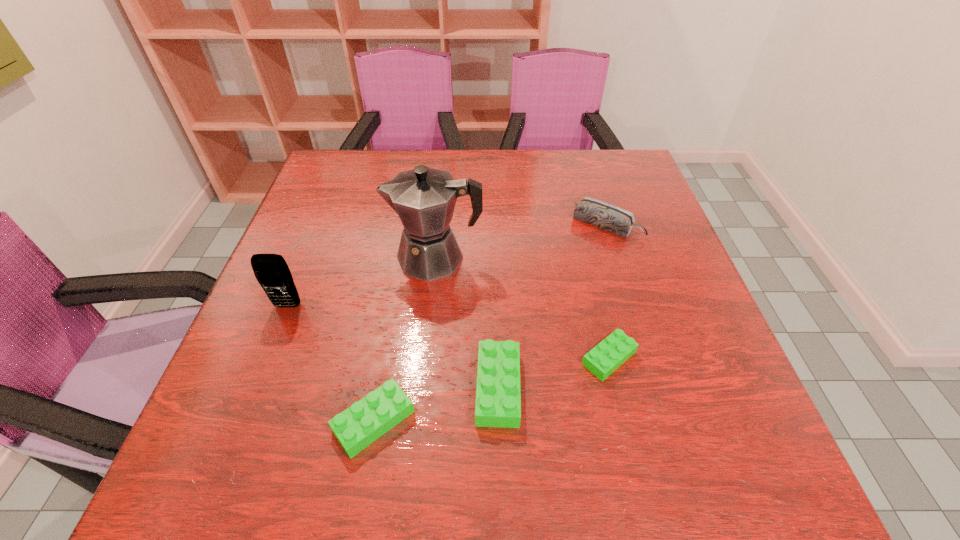
You are a GUI agent. You are given a task and a screenshot of the screen. Output one action in this format:
    pyautogui.click(x=<x>, y=<y>)
    Task: Click on the free point between the fifth shortest object and the rightmost Lego
    This screenshot has height=540, width=960.
    Given the screenshot: What is the action you would take?
    pyautogui.click(x=448, y=332)

This screenshot has height=540, width=960. What are the coordinates of `vacant space that's between the tallest object and the second Lego from right to left` in the screenshot? It's located at (467, 322).

I want to click on unoccupied area between the leftmost Lego and the tallest object, so click(405, 339).

Locate an element on the screen. unoccupied position between the rightmost Lego and the leftmost object is located at coordinates (448, 332).

Identify which object is located as the fourth nearest to the cellular telephone. Please provide its 2D coordinates. Your answer should be formatted as a tuple, i.e. [(x, y)], where the tuple contains the x and y coordinates of a point satisfying the conditions above.

[(614, 350)]

The height and width of the screenshot is (540, 960). I want to click on object that is the closest to the fifth tallest object, so click(x=498, y=399).

Find the location of `Lego that is the second closest to the coffeepot`. Lego that is the second closest to the coffeepot is located at coordinates (614, 350).

Identify the location of the second closest Lego to the leftmost object. (498, 399).

This screenshot has width=960, height=540. I want to click on vacant region that satisfies the following two spatial constraints: 1. on the screen of the second tallest object; 2. on the right side of the second tallest Lego, so click(242, 421).

Identify the location of free region that satisfies the following two spatial constraints: 1. on the screen of the rightmost Lego; 2. on the right side of the leftmost object. (267, 358).